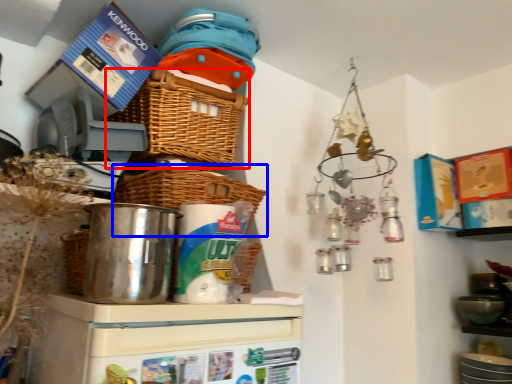
Question: Among these objects, which one is farthest to the camera, basket (highlighted by a red box) or basket (highlighted by a blue box)?

Choices:
 (A) basket
 (B) basket

Answer: (A)